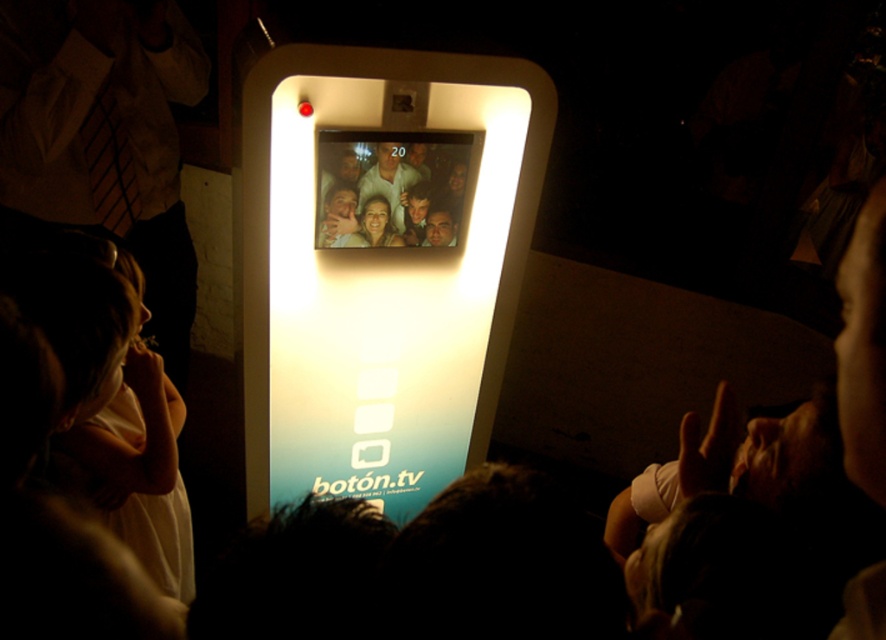
You are at an event and want to take a photo using the photo booth. You see a matte white phone at left and a matte white face at center. Which object is closer to the left edge of the photo booth screen?

The matte white phone at left is closer to the left edge of the photo booth screen because it is positioned on the left side of the matte white face at center.

You are designing a poster for the photo booth and want to highlight both the light pink fabric at left and the matte white face at center. Which object should you make larger in the poster to maintain the original scene proportions?

The light pink fabric at left should be made larger in the poster since it has a larger size compared to the matte white face at center in the original scene.

You are at an event and want to take a photo using the photo booth. You notice a matte white phone at left and a matte white face at center. Which object is taller?

The matte white phone at left is taller than the matte white face at center.